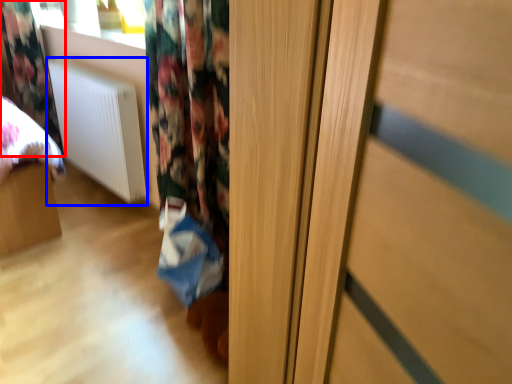
Question: Among these objects, which one is nearest to the camera, curtain (highlighted by a red box) or radiator (highlighted by a blue box)?

Choices:
 (A) curtain
 (B) radiator

Answer: (B)